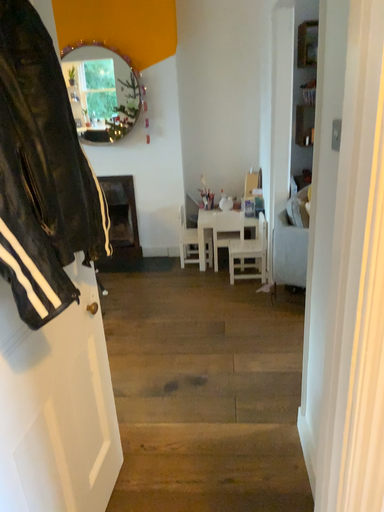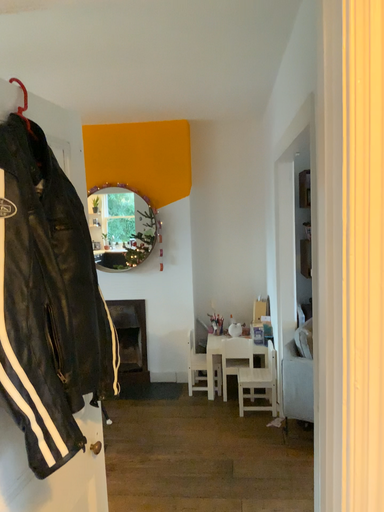
Question: Which way did the camera rotate in the video?

Choices:
 (A) rotated upward
 (B) rotated downward

Answer: (A)